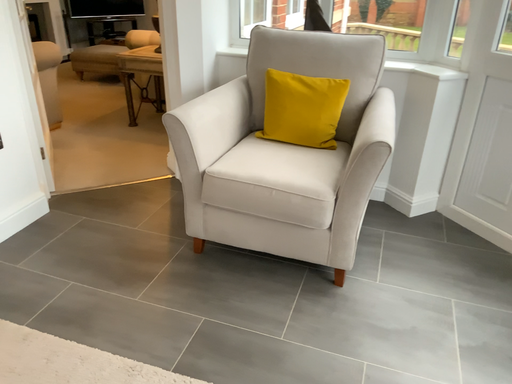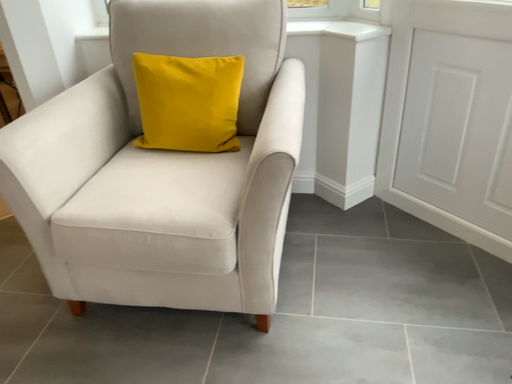
Question: How did the camera likely rotate when shooting the video?

Choices:
 (A) rotated left
 (B) rotated right

Answer: (B)